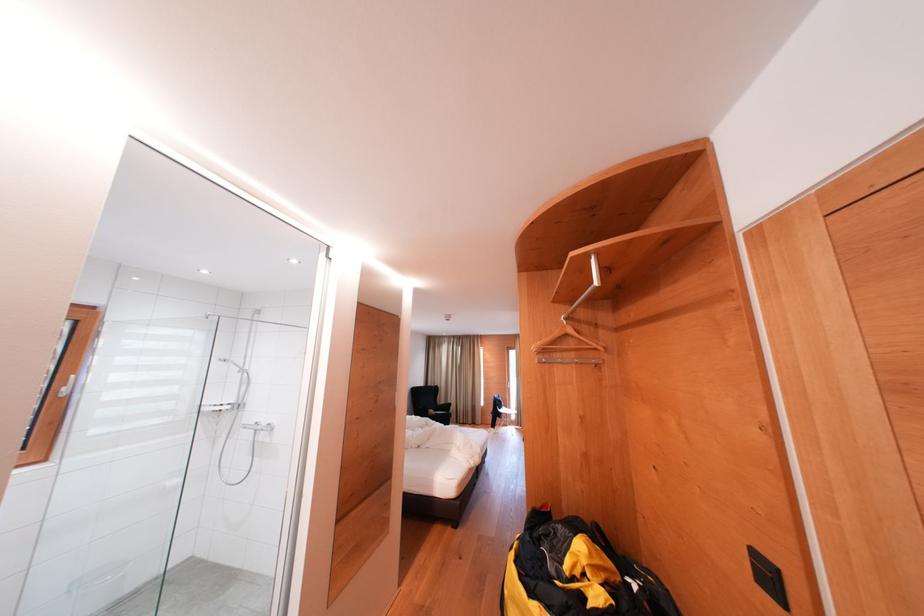
Image resolution: width=924 pixels, height=616 pixels. In order to click on shower control lever in this screenshot , I will do `click(258, 427)`.